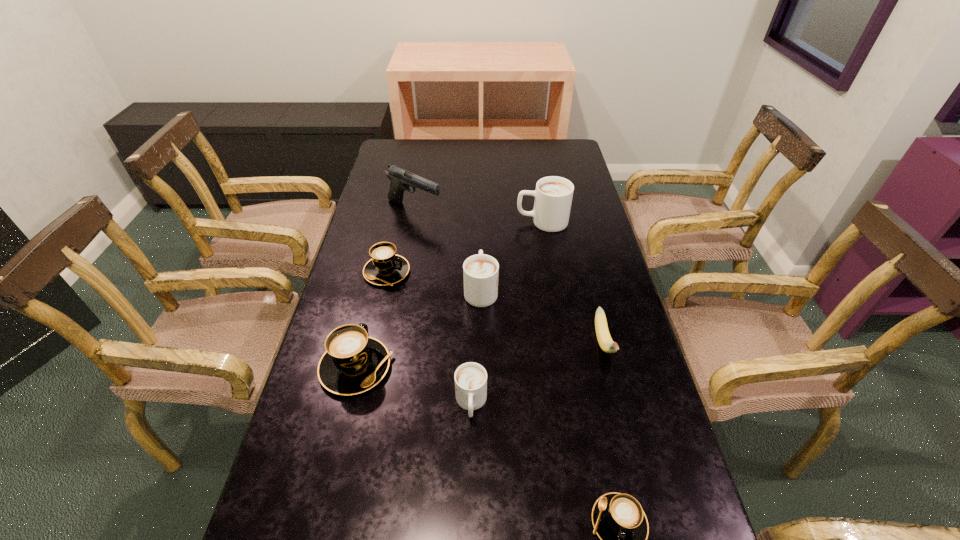
Find the location of `unoccupied area between the yellow banana and the second biggest white cappuccino`. unoccupied area between the yellow banana and the second biggest white cappuccino is located at coordinates (542, 316).

The width and height of the screenshot is (960, 540). What are the coordinates of `free spot between the biggest black cappuccino and the second biggest white cappuccino` in the screenshot? It's located at (419, 328).

This screenshot has height=540, width=960. I want to click on object that stands as the third closest to the gun, so click(x=480, y=272).

Image resolution: width=960 pixels, height=540 pixels. In order to click on object that is the second closest to the farthest black cappuccino in this screenshot , I will do `click(401, 179)`.

This screenshot has width=960, height=540. I want to click on cappuccino that stands as the third closest to the second farthest white cappuccino, so click(x=553, y=195).

Identify the location of cappuccino object that ranks as the closest to the gun. (385, 268).

Point out which white cappuccino is positioned as the second nearest to the smallest white cappuccino. Please provide its 2D coordinates. Your answer should be formatted as a tuple, i.e. [(x, y)], where the tuple contains the x and y coordinates of a point satisfying the conditions above.

[(553, 195)]

Locate an element on the screen. The width and height of the screenshot is (960, 540). white cappuccino that is the second closest to the smallest white cappuccino is located at coordinates (553, 195).

Where is `the second closest black cappuccino relative to the farthest black cappuccino`? the second closest black cappuccino relative to the farthest black cappuccino is located at coordinates (618, 519).

In order to click on the third closest black cappuccino relative to the banana in this screenshot , I will do click(385, 268).